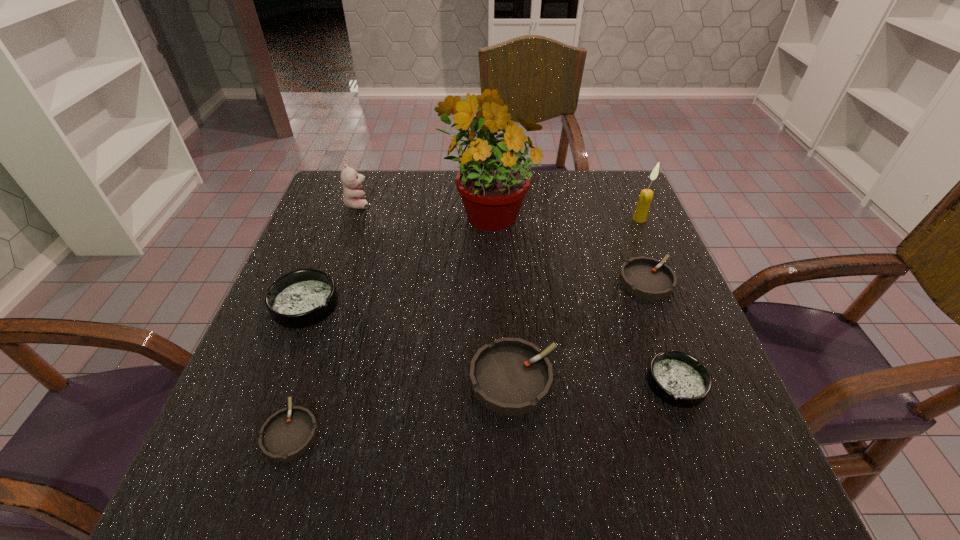
You are a GUI agent. You are given a task and a screenshot of the screen. Output one action in this format:
    pyautogui.click(x=<x>, y=<y>)
    Task: Click on the third closest gray ashtray to the third tallest object
    
    Given the screenshot: What is the action you would take?
    pyautogui.click(x=647, y=278)

Choose which gray ashtray is the nearest neighbor to the rightmost gray ashtray. Please provide its 2D coordinates. Your answer should be formatted as a tuple, i.e. [(x, y)], where the tuple contains the x and y coordinates of a point satisfying the conditions above.

[(510, 376)]

Identify the location of free space in the image that satisfies the following two spatial constraints: 1. on the back side of the farthest gray ashtray; 2. on the left side of the right dark ashtray. The width and height of the screenshot is (960, 540). (638, 281).

Identify the location of vacant space that satisfies the following two spatial constraints: 1. at the face of the teddy bear; 2. on the right side of the candle. Image resolution: width=960 pixels, height=540 pixels. (352, 219).

Find the location of a particular element. The width and height of the screenshot is (960, 540). blank space that satisfies the following two spatial constraints: 1. at the face of the smaller dark ashtray; 2. on the left side of the pink teddy bear is located at coordinates (297, 383).